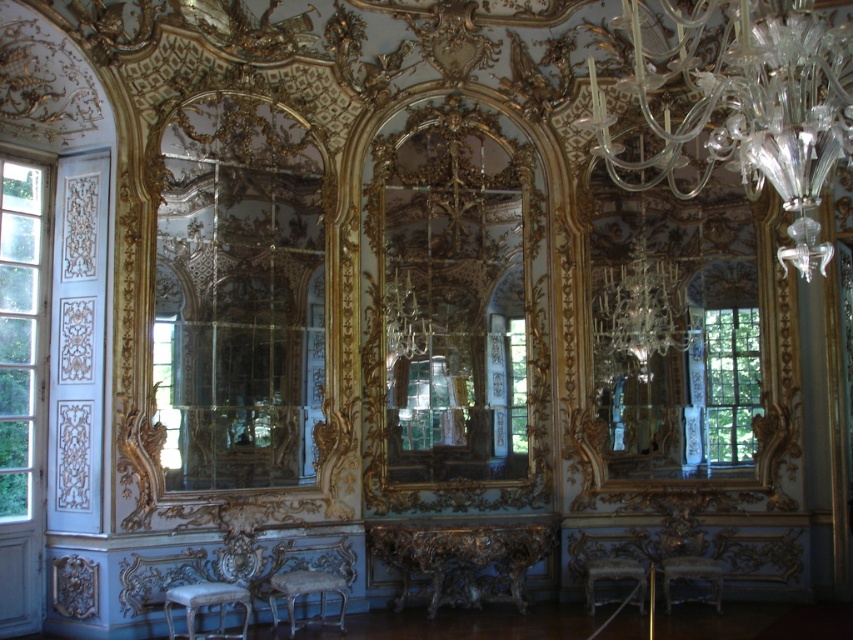
In the scene shown: You are standing in the grand room and want to sit down. You see a silver metallic chair at lower center and a white fabric stool at center. Which one is closer to you?

The silver metallic chair at lower center is closer to you than the white fabric stool at center.